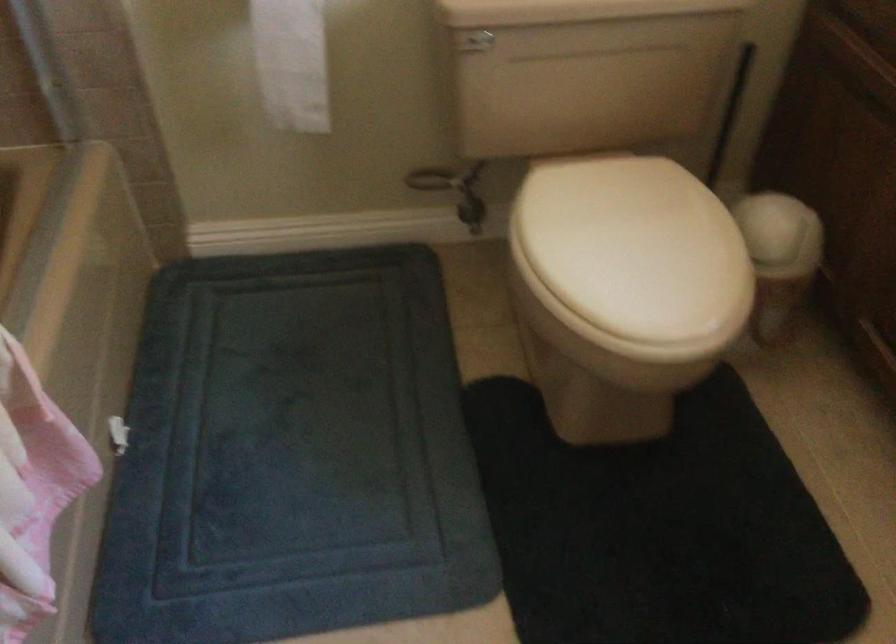
This screenshot has width=896, height=644. What do you see at coordinates (634, 247) in the screenshot?
I see `a white toilet lid` at bounding box center [634, 247].